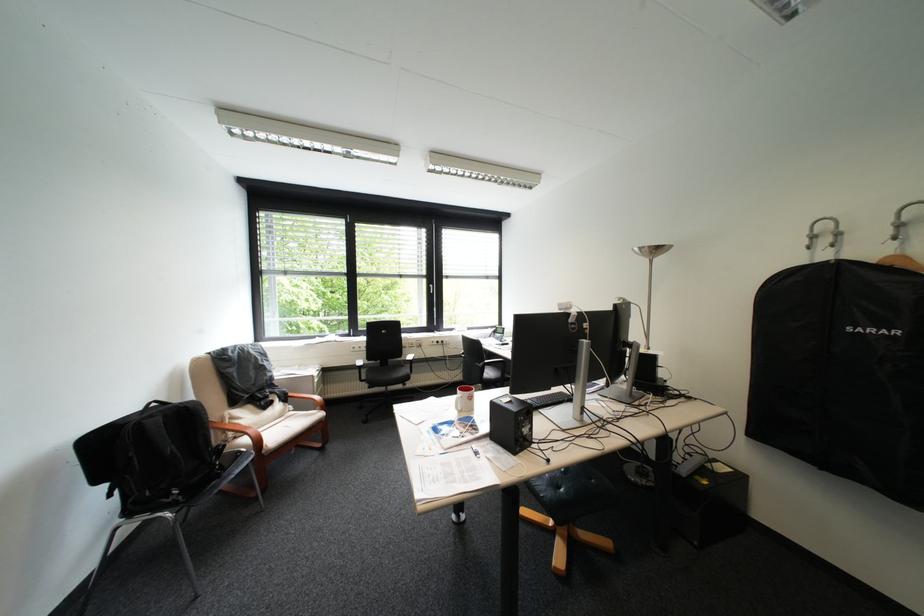
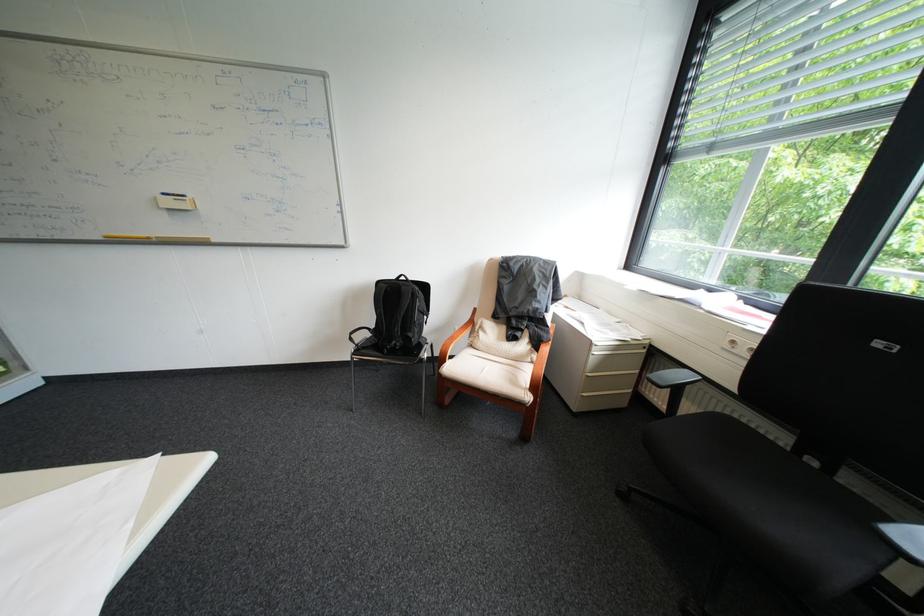
Where in the second image is the point corresponding to the point at 199,407 from the first image?

(415, 288)